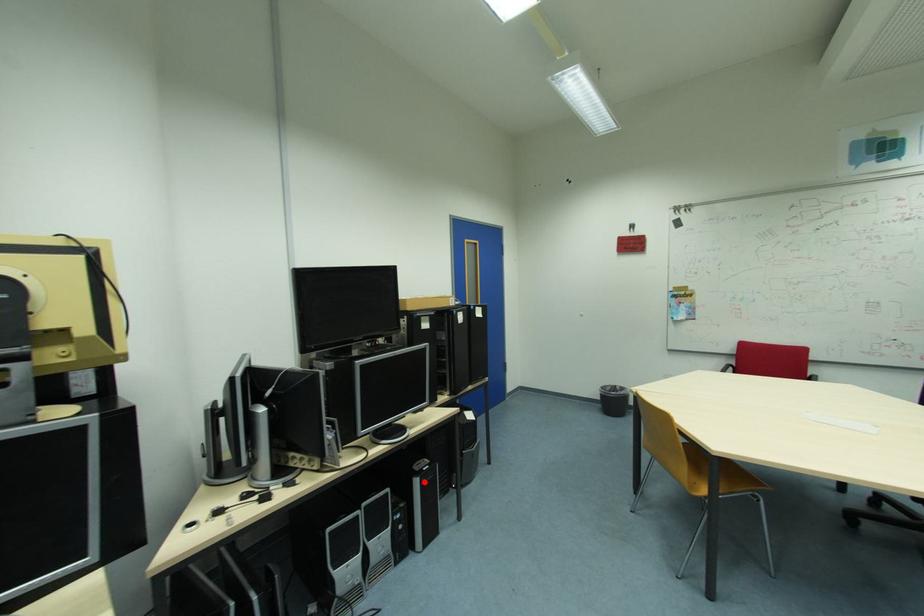
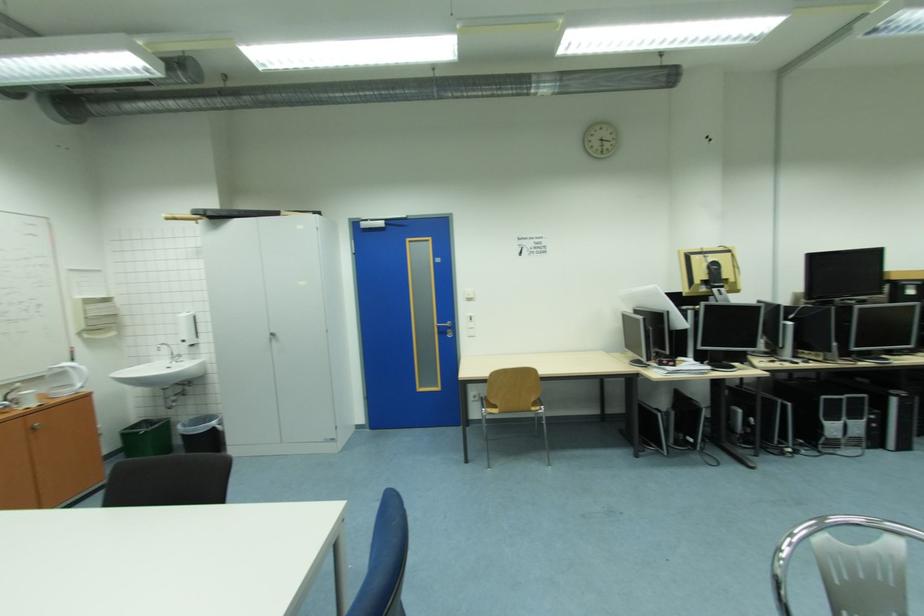
Locate, in the second image, the point that corresponds to the highlighted location in the first image.

(901, 400)